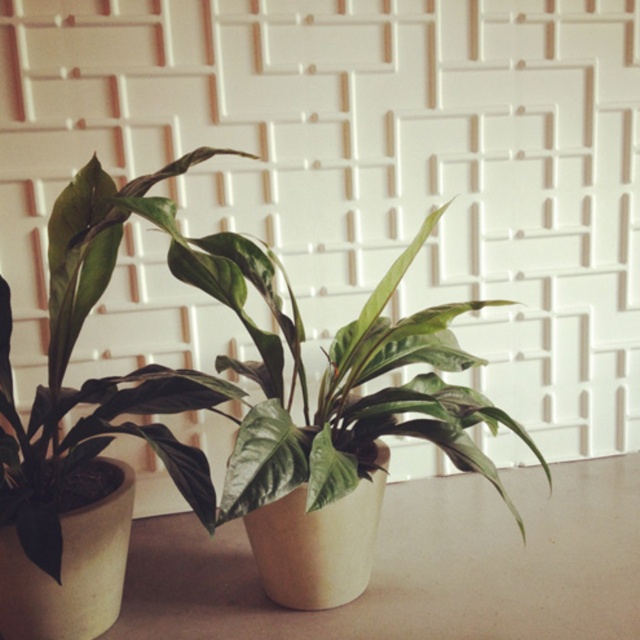
You are a gardener who wants to water both plants. You notice that the green matte leafy plant at center and the green matte leafy plant at left are positioned in a way that might block the sunlight. Which plant is casting a shadow over the other?

The green matte leafy plant at left is casting a shadow over the green matte leafy plant at center because it is positioned above it.

You have a small decorative item that is 10 cm wide. You want to place it on the beige matte table at center so that it doesn t block the green matte leafy plant at center. Is there enough space on the table for the item without overlapping the plant?

The beige matte table at center is wider than the green matte leafy plant at center. Since the table is wider, there should be enough space to place the 10 cm wide decorative item without overlapping the plant.